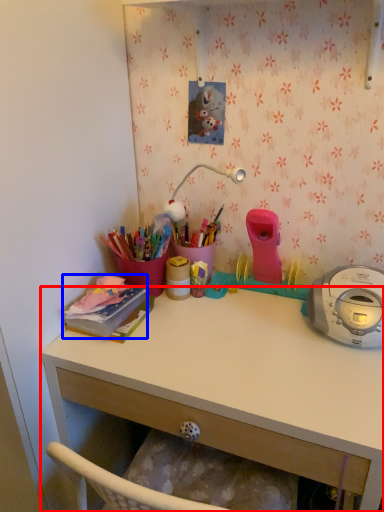
Question: Which of the following is the farthest to the observer, desk (highlighted by a red box) or office supplies (highlighted by a blue box)?

Choices:
 (A) desk
 (B) office supplies

Answer: (B)